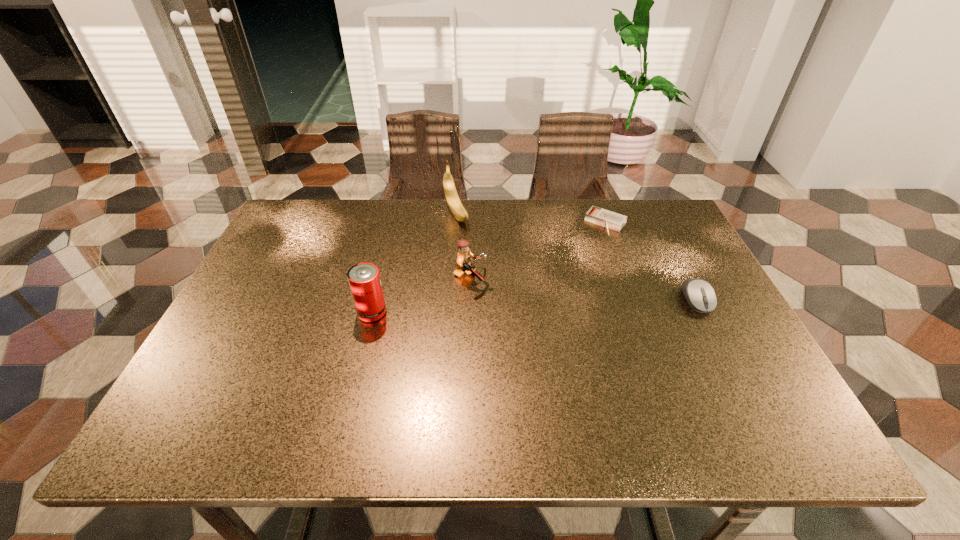
You are a GUI agent. You are given a task and a screenshot of the screen. Output one action in this format:
    pyautogui.click(x=<x>, y=<y>)
    Task: Click on the free region located holding a crossbow in the hands of the Lego
    Image resolution: width=960 pixels, height=540 pixels.
    Given the screenshot: What is the action you would take?
    pyautogui.click(x=589, y=325)

I want to click on vacant space situated holding a crossbow in the hands of the Lego, so click(x=577, y=321).

Where is `blank space located 0.250m holding a crossbow in the hands of the Lego`? blank space located 0.250m holding a crossbow in the hands of the Lego is located at coordinates (577, 321).

Find the location of `vacant space located at the start of the peel on the tallest object`. vacant space located at the start of the peel on the tallest object is located at coordinates (495, 279).

Where is `vacant space situated at the start of the peel on the tallest object`? The image size is (960, 540). vacant space situated at the start of the peel on the tallest object is located at coordinates pyautogui.click(x=479, y=255).

Identify the location of free region located 0.120m at the start of the peel on the tallest object. The width and height of the screenshot is (960, 540). (476, 251).

Identify the location of vacant space located on the striking surface of the matchbox. (564, 279).

Identify the location of vacant space situated on the striking surface of the matchbox. The image size is (960, 540). (544, 304).

What are the coordinates of `vacant point located 0.360m on the striking surface of the matchbox` in the screenshot? It's located at (542, 307).

Locate an element on the screen. The width and height of the screenshot is (960, 540). banana that is at the far edge is located at coordinates (456, 207).